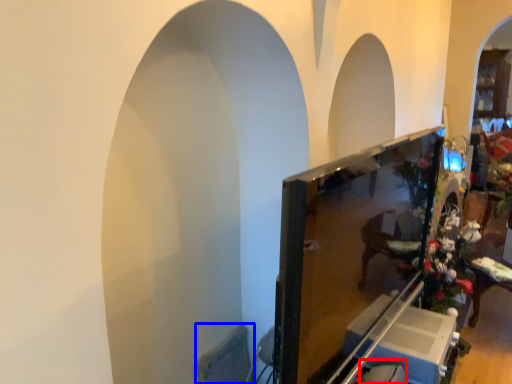
Question: Which object is closer to the camera taking this photo, swivel chair (highlighted by a red box) or swivel chair (highlighted by a blue box)?

Choices:
 (A) swivel chair
 (B) swivel chair

Answer: (A)